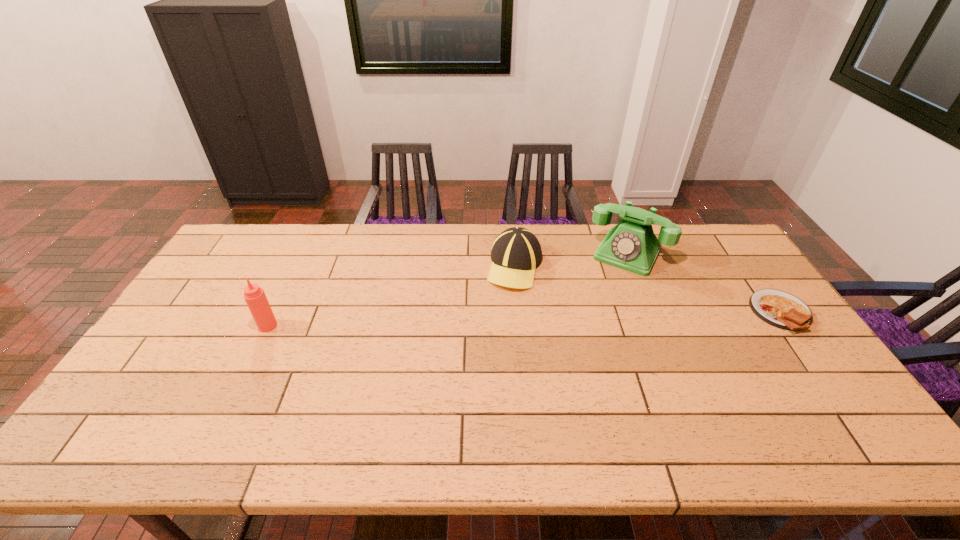
The image size is (960, 540). What are the coordinates of `free spot on the desktop that is between the Tabasco sauce and the rightmost object and is positioned on the dial of the third object from left to right` in the screenshot? It's located at (592, 317).

At what (x,y) coordinates should I click in order to perform the action: click on free space on the desktop that is between the Tabasco sauce and the rightmost object and is positioned with the brim of the baseball cap facing forward. Please return your answer as a coordinate pair (x, y). The height and width of the screenshot is (540, 960). Looking at the image, I should click on (481, 320).